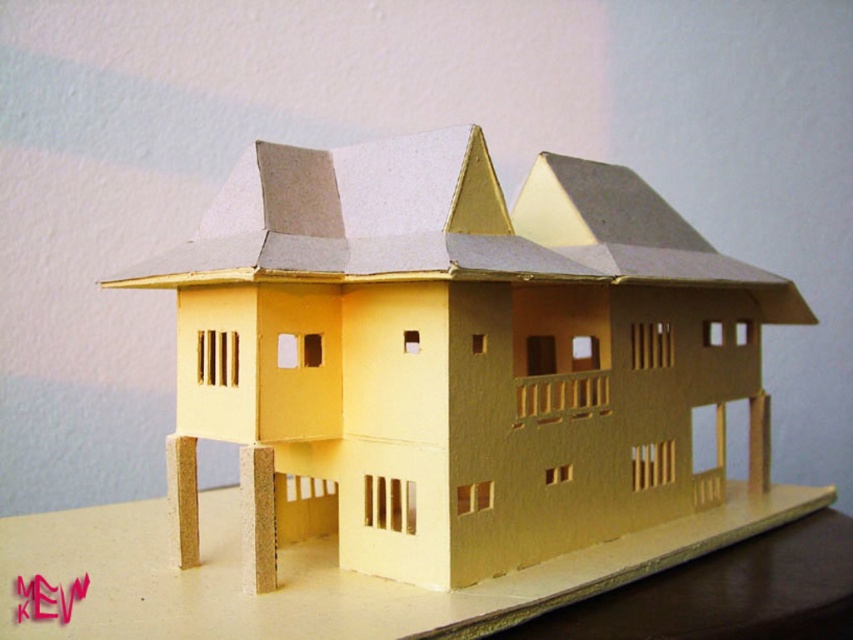
Can you confirm if matte cardboard house at center is positioned above matte cardboard table at lower center?

Yes.

Does matte cardboard house at center lie in front of matte cardboard table at lower center?

No, it is not.

Who is more distant from viewer, (608, 204) or (73, 524)?

The point (73, 524) is behind.

You are a GUI agent. You are given a task and a screenshot of the screen. Output one action in this format:
    pyautogui.click(x=<x>, y=<y>)
    Task: Click on the matte cardboard house at center
    
    Given the screenshot: What is the action you would take?
    pyautogui.click(x=456, y=356)